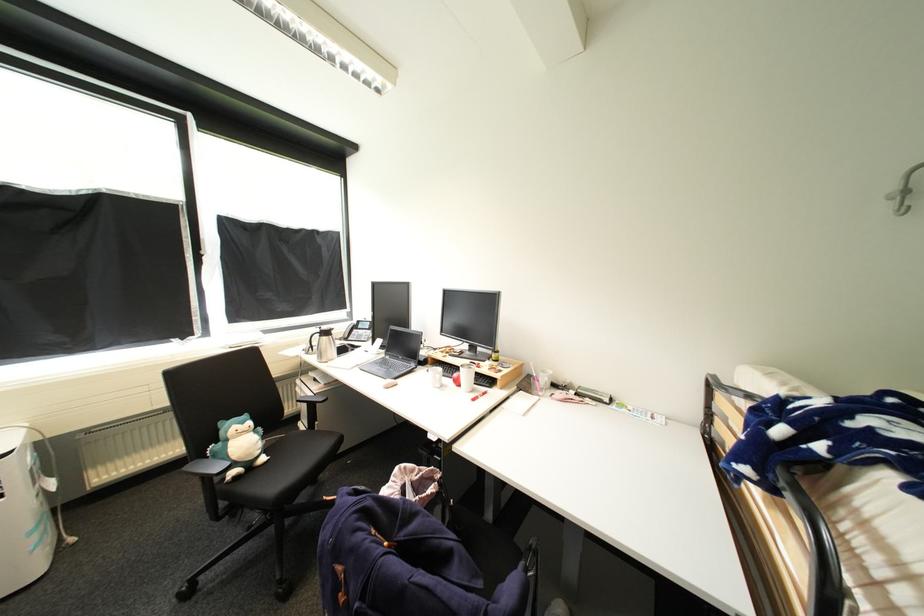
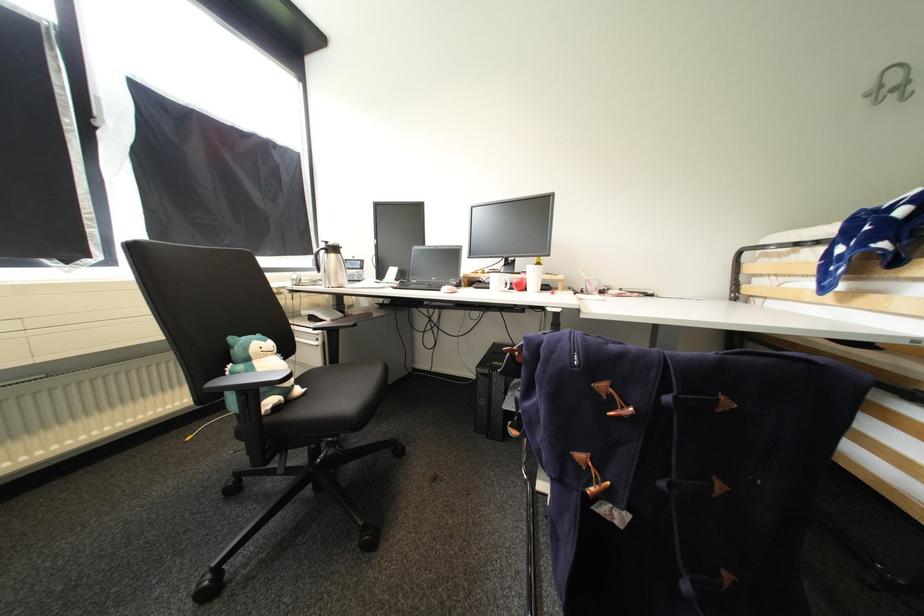
Where in the second image is the point corresponding to point (270, 460) from the first image?

(306, 391)